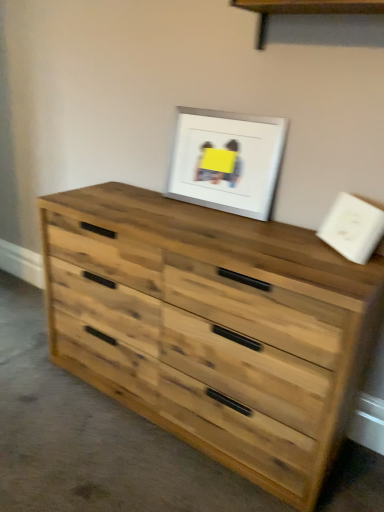
Question: Is natural wood chest of drawers at center surrounding white matte picture frame at upper center?

Choices:
 (A) no
 (B) yes

Answer: (A)

Question: From the image's perspective, is natural wood chest of drawers at center below white matte picture frame at upper center?

Choices:
 (A) yes
 (B) no

Answer: (A)

Question: Is natural wood chest of drawers at center to the left of white matte picture frame at upper center from the viewer's perspective?

Choices:
 (A) yes
 (B) no

Answer: (A)

Question: Does natural wood chest of drawers at center have a lesser width compared to white matte picture frame at upper center?

Choices:
 (A) yes
 (B) no

Answer: (B)

Question: Is natural wood chest of drawers at center bigger than white matte picture frame at upper center?

Choices:
 (A) no
 (B) yes

Answer: (B)

Question: From a real-world perspective, is natural wood chest of drawers at center under white matte picture frame at upper center?

Choices:
 (A) no
 (B) yes

Answer: (B)

Question: Is natural wood chest of drawers at center far away from wooden shelf at upper center?

Choices:
 (A) yes
 (B) no

Answer: (B)

Question: From the image's perspective, is natural wood chest of drawers at center on wooden shelf at upper center?

Choices:
 (A) yes
 (B) no

Answer: (B)

Question: Is natural wood chest of drawers at center to the right of wooden shelf at upper center from the viewer's perspective?

Choices:
 (A) yes
 (B) no

Answer: (B)

Question: Does natural wood chest of drawers at center have a greater width compared to wooden shelf at upper center?

Choices:
 (A) yes
 (B) no

Answer: (A)

Question: From a real-world perspective, does natural wood chest of drawers at center stand above wooden shelf at upper center?

Choices:
 (A) no
 (B) yes

Answer: (A)

Question: Can you confirm if natural wood chest of drawers at center is shorter than wooden shelf at upper center?

Choices:
 (A) no
 (B) yes

Answer: (A)

Question: From the image's perspective, is white matte picture frame at upper center on natural wood chest of drawers at center?

Choices:
 (A) no
 (B) yes

Answer: (B)